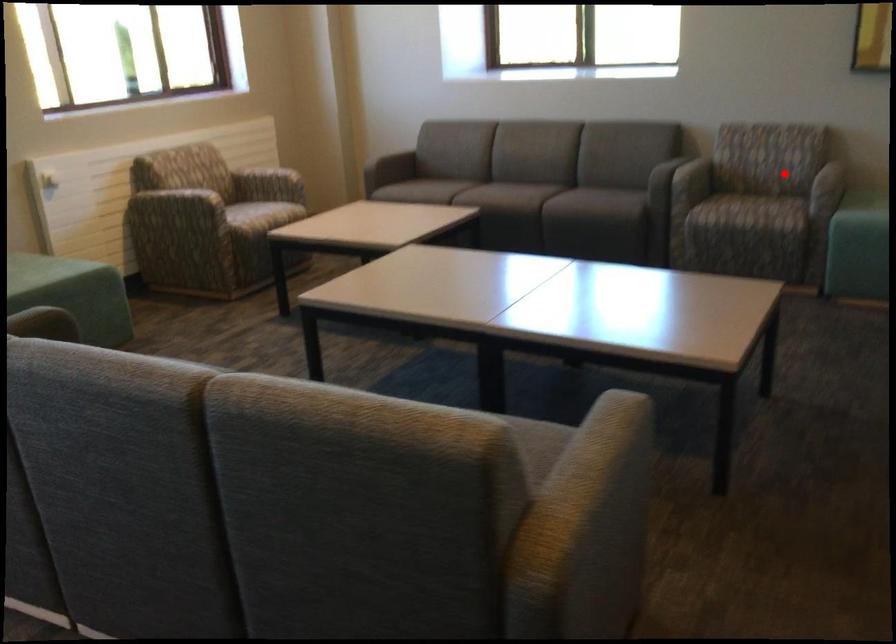
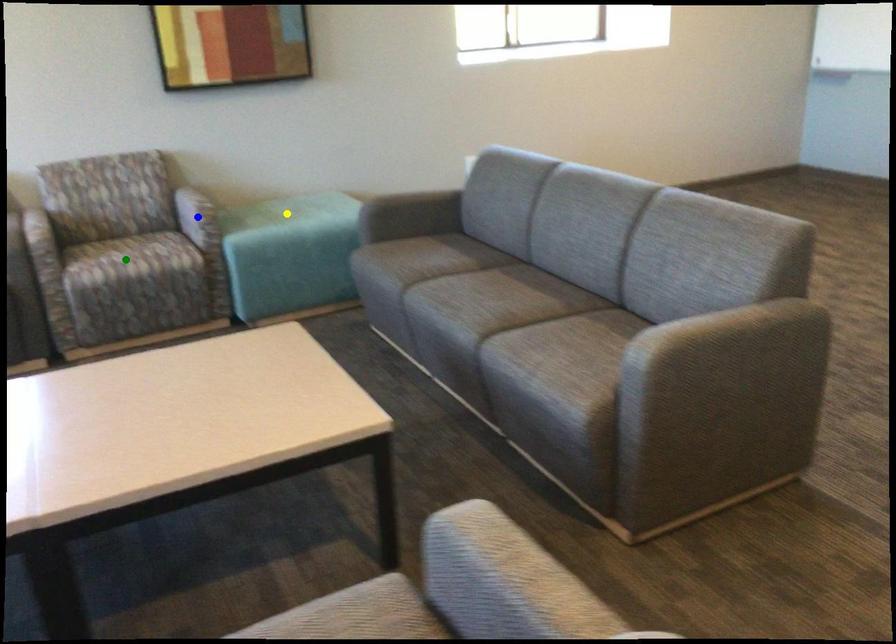
Question: I am providing you with two images of the same scene from different viewpoints. A red point is marked on the first image. You are given multiple points on the second image. Which point in image 2 represents the same 3d spot as the red point in image 1?

Choices:
 (A) green point
 (B) yellow point
 (C) blue point

Answer: (C)